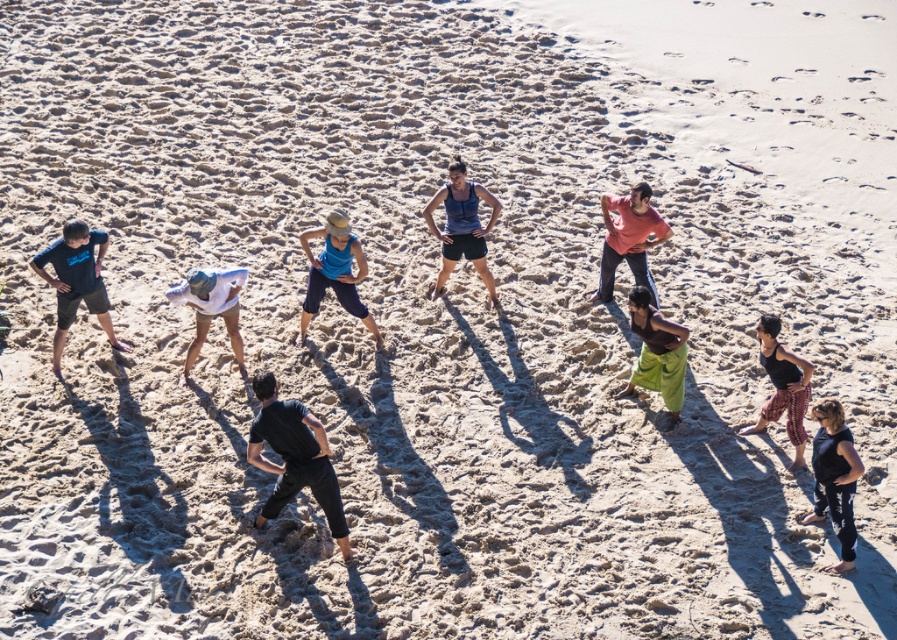
You are planning to buy shorts for a beach day. You want to choose between the matte black shorts at left and the blue fabric shorts at center. Based on the image, which pair of shorts is narrower in width?

The matte black shorts at left is thinner than blue fabric shorts at center, so the matte black shorts at left is narrower in width.

You are a photographer trying to capture a group photo of the matte black shorts at left and the black matte tank top at lower right. Since you want to ensure both subjects are in focus, you need to know which one is wider. Which one has a greater width?

The matte black shorts at left has a greater width than the black matte tank top at lower right.